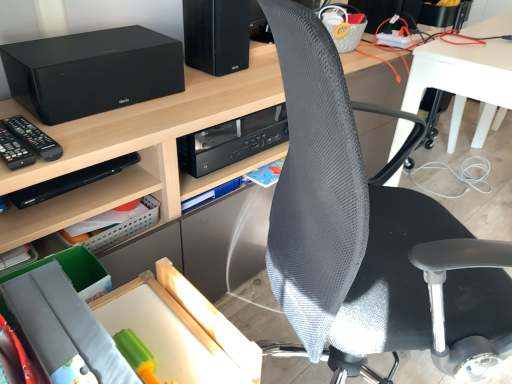
Measure the distance between point (226,33) and camera.

The distance of point (226,33) from camera is 1.27 meters.

What do you see at coordinates (217, 35) in the screenshot? Image resolution: width=512 pixels, height=384 pixels. I see `black matte computer tower at upper center` at bounding box center [217, 35].

Based on the photo, measure the distance between point (35, 147) and camera.

A distance of 33.62 inches exists between point (35, 147) and camera.

This screenshot has width=512, height=384. Describe the element at coordinates (370, 236) in the screenshot. I see `black mesh chair at center` at that location.

What do you see at coordinates (92, 72) in the screenshot? This screenshot has width=512, height=384. I see `black matte speaker at upper left` at bounding box center [92, 72].

Locate an element on the screen. Image resolution: width=512 pixels, height=384 pixels. black plastic shelf at lower left is located at coordinates (80, 202).

The height and width of the screenshot is (384, 512). What are the coordinates of `black matte computer tower at upper center` in the screenshot? It's located at (217, 35).

Is black matte speaker at upper left at the left side of black matte computer tower at upper center?

Yes, black matte speaker at upper left is to the left of black matte computer tower at upper center.

You are a GUI agent. You are given a task and a screenshot of the screen. Output one action in this format:
    pyautogui.click(x=<x>, y=<y>)
    Task: Click on the stereo to the left of black matte computer tower at upper center
    This screenshot has height=384, width=512.
    Given the screenshot: What is the action you would take?
    pyautogui.click(x=92, y=72)

From a real-world perspective, which object rests below the other?

black matte speaker at upper left, from a real-world perspective.

Which is behind, point (27, 74) or point (227, 67)?

The point (227, 67) is more distant.

Is black matte computer tower at upper center inside or outside of black plastic remote control at left?

black matte computer tower at upper center exists outside the volume of black plastic remote control at left.

Does black matte computer tower at upper center turn towards black plastic remote control at left?

No, black matte computer tower at upper center is not aimed at black plastic remote control at left.

Identify the location of equipment to the left of black matte computer tower at upper center. (33, 138).

Considering the relative sizes of black matte computer tower at upper center and black plastic remote control at left in the image provided, is black matte computer tower at upper center taller than black plastic remote control at left?

Yes.

I want to click on chair on the right of black plastic remote control at left, so click(370, 236).

Can you confirm if black mesh chair at center is thinner than black plastic remote control at left?

No, black mesh chair at center is not thinner than black plastic remote control at left.

Based on their sizes in the image, would you say black mesh chair at center is bigger or smaller than black plastic remote control at left?

Clearly, black mesh chair at center is larger in size than black plastic remote control at left.

From a real-world perspective, which is physically below, black mesh chair at center or black plastic remote control at left?

black mesh chair at center.

Who is shorter, black matte computer tower at upper center or black matte speaker at upper left?

Standing shorter between the two is black matte speaker at upper left.

What are the coordinates of `stereo in front of the black matte computer tower at upper center` in the screenshot? It's located at (92, 72).

From a real-world perspective, is black matte computer tower at upper center under black matte speaker at upper left?

No.

From the image's perspective, between black matte computer tower at upper center and black matte speaker at upper left, which one is located above?

black matte computer tower at upper center, from the image's perspective.

Can you confirm if black plastic shelf at lower left is positioned to the right of black matte speaker at upper left?

No, black plastic shelf at lower left is not to the right of black matte speaker at upper left.

Is black plastic shelf at lower left not near black matte speaker at upper left?

No.

From the picture: Which object is closer to the camera, black plastic shelf at lower left or black matte speaker at upper left?

black matte speaker at upper left is closer to the camera.

Does black plastic shelf at lower left have a lesser width compared to black matte speaker at upper left?

Correct, the width of black plastic shelf at lower left is less than that of black matte speaker at upper left.

Looking at this image, is black mesh chair at center at the back of black plastic shelf at lower left?

No, black plastic shelf at lower left is not facing the opposite direction of black mesh chair at center.

From the picture: From the image's perspective, which is above, black plastic shelf at lower left or black mesh chair at center?

black plastic shelf at lower left.

From a real-world perspective, is black plastic shelf at lower left physically below black mesh chair at center?

Actually, black plastic shelf at lower left is physically above black mesh chair at center in the real world.

Looking at their sizes, would you say black plastic shelf at lower left is wider or thinner than black mesh chair at center?

Considering their sizes, black plastic shelf at lower left looks slimmer than black mesh chair at center.

How different are the orientations of black mesh chair at center and black matte speaker at upper left in degrees?

They differ by 52.8 degrees in their facing directions.

Does black mesh chair at center have a lesser height compared to black matte speaker at upper left?

No, black mesh chair at center is not shorter than black matte speaker at upper left.

Considering the relative positions of black mesh chair at center and black matte speaker at upper left in the image provided, is black mesh chair at center to the left or to the right of black matte speaker at upper left?

Based on their positions, black mesh chair at center is located to the right of black matte speaker at upper left.

At what (x,y) coordinates should I click in order to perform the action: click on computer tower on the right of black matte speaker at upper left. Please return your answer as a coordinate pair (x, y). Looking at the image, I should click on (217, 35).

In order to click on computer tower above the black plastic remote control at left (from the image's perspective) in this screenshot , I will do `click(217, 35)`.

Looking at the image, which one is located further to black mesh chair at center, black plastic remote control at left or black matte computer tower at upper center?

black matte computer tower at upper center is further to black mesh chair at center.

From the picture: Based on their spatial positions, is black mesh chair at center or black plastic remote control at left further from black matte speaker at upper left?

black mesh chair at center.

Estimate the real-world distances between objects in this image. Which object is further from black matte computer tower at upper center, black plastic remote control at left or black mesh chair at center?

black mesh chair at center lies further to black matte computer tower at upper center than the other object.

Looking at the image, which one is located closer to black plastic remote control at left, black matte speaker at upper left or black mesh chair at center?

black matte speaker at upper left is positioned closer to the anchor black plastic remote control at left.

Considering their positions, is black plastic shelf at lower left positioned further to black matte computer tower at upper center than black matte speaker at upper left?

The object further to black matte computer tower at upper center is black plastic shelf at lower left.

Estimate the real-world distances between objects in this image. Which object is further from black mesh chair at center, black plastic shelf at lower left or black matte speaker at upper left?

black matte speaker at upper left.

From the image, which object appears to be nearer to black plastic shelf at lower left, black plastic remote control at left or black mesh chair at center?

The object closer to black plastic shelf at lower left is black plastic remote control at left.

Looking at the image, which one is located further to black plastic remote control at left, black plastic shelf at lower left or black matte speaker at upper left?

black matte speaker at upper left is positioned further to the anchor black plastic remote control at left.

Locate an element on the screen. This screenshot has height=384, width=512. stereo between black plastic remote control at left and black matte computer tower at upper center in the front-back direction is located at coordinates (92, 72).

This screenshot has width=512, height=384. Find the location of `stereo between black mesh chair at center and black matte computer tower at upper center from front to back`. stereo between black mesh chair at center and black matte computer tower at upper center from front to back is located at coordinates (92, 72).

I want to click on stereo situated between black plastic remote control at left and black mesh chair at center from left to right, so click(x=92, y=72).

Locate an element on the screen. This screenshot has width=512, height=384. equipment between black mesh chair at center and black matte computer tower at upper center along the z-axis is located at coordinates click(33, 138).